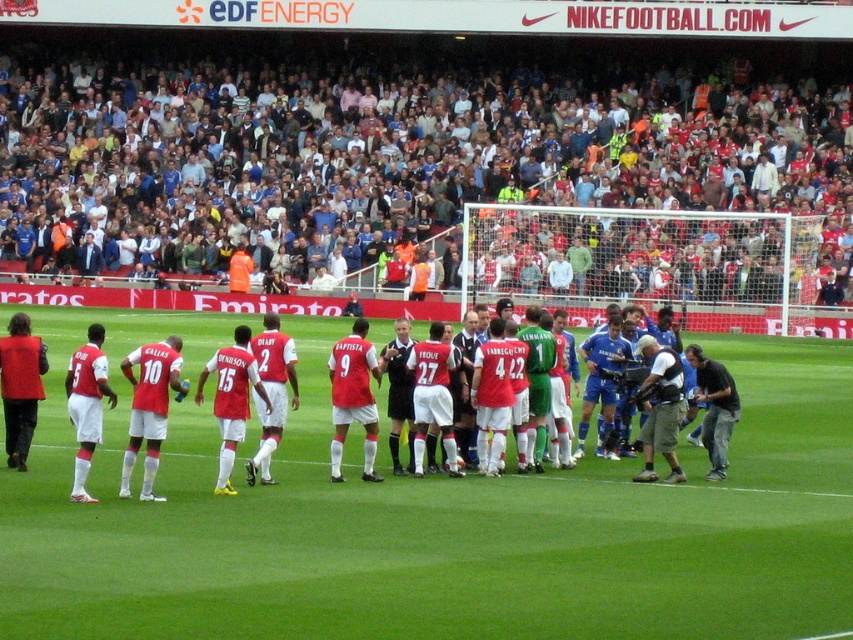
Can you confirm if white matte soccer team at center is positioned above dark gray fabric camera at lower right?

Indeed, white matte soccer team at center is positioned over dark gray fabric camera at lower right.

Can you confirm if white matte soccer team at center is taller than dark gray fabric camera at lower right?

Indeed, white matte soccer team at center has a greater height compared to dark gray fabric camera at lower right.

Locate an element on the screen. white matte soccer team at center is located at coordinates (352, 472).

Who is higher up, green grass field at center or dark gray fabric camera at lower right?

dark gray fabric camera at lower right

Does green grass field at center have a larger size compared to dark gray fabric camera at lower right?

Indeed, green grass field at center has a larger size compared to dark gray fabric camera at lower right.

Between point (814, 372) and point (703, 396), which one is positioned behind?

The point (814, 372) is more distant.

At what (x,y) coordinates should I click in order to perform the action: click on green grass field at center. Please return your answer as a coordinate pair (x, y). This screenshot has width=853, height=640. Looking at the image, I should click on (432, 520).

Does green grass field at center have a lesser width compared to white fabric crowd at upper center?

Indeed, green grass field at center has a lesser width compared to white fabric crowd at upper center.

Can you confirm if green grass field at center is wider than white fabric crowd at upper center?

In fact, green grass field at center might be narrower than white fabric crowd at upper center.

Who is more distant from viewer, (764, 595) or (119, 125)?

The point (119, 125) is more distant.

Locate an element on the screen. green grass field at center is located at coordinates (432, 520).